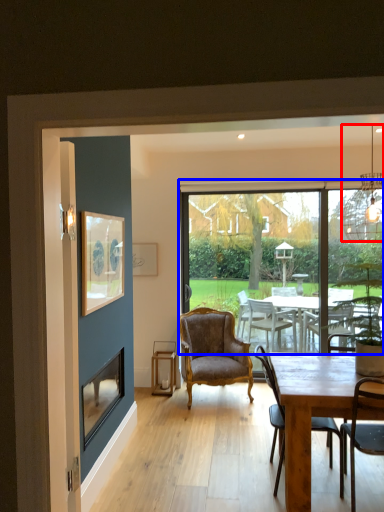
Question: Among these objects, which one is nearest to the camera, lamp (highlighted by a red box) or window (highlighted by a blue box)?

Choices:
 (A) lamp
 (B) window

Answer: (A)